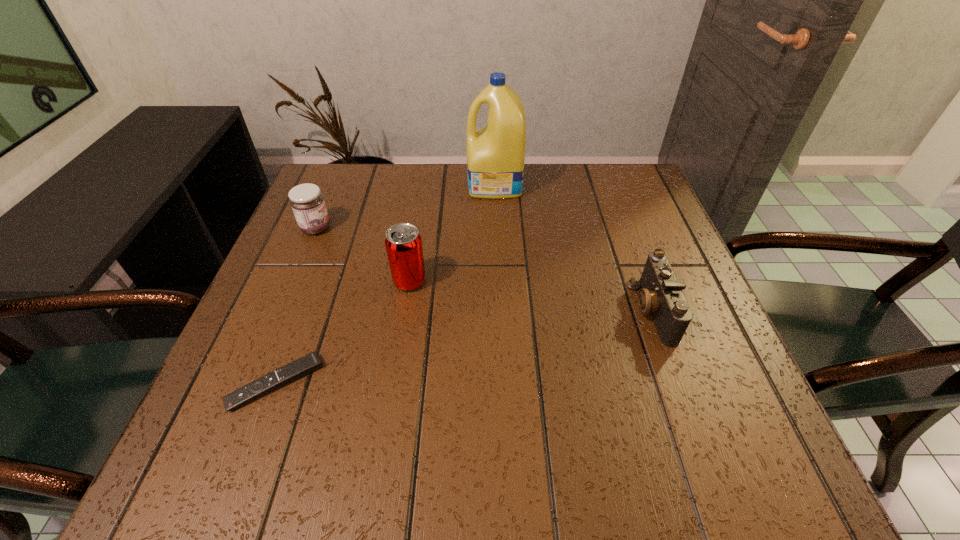
Identify the location of remote control at the left edge. (309, 363).

What are the coordinates of `object located in the right edge section of the desktop` in the screenshot? It's located at (661, 294).

The height and width of the screenshot is (540, 960). What are the coordinates of `vacant region at the far edge of the desktop` in the screenshot? It's located at (372, 200).

In order to click on vacant space at the left edge of the desktop in this screenshot , I will do `click(230, 384)`.

This screenshot has height=540, width=960. In order to click on vacant space at the right edge in this screenshot , I will do `click(618, 217)`.

In order to click on vacant space at the far left corner of the desktop in this screenshot , I will do `click(326, 182)`.

Locate an element on the screen. This screenshot has width=960, height=540. vacant region at the near left corner of the desktop is located at coordinates (188, 469).

The image size is (960, 540). I want to click on vacant area at the far right corner, so click(602, 209).

Where is `vacant area that lies between the second shortest object and the second farthest object`? vacant area that lies between the second shortest object and the second farthest object is located at coordinates (484, 269).

Where is `vacant area that lies between the third object from right to left and the remote control`? vacant area that lies between the third object from right to left and the remote control is located at coordinates (343, 332).